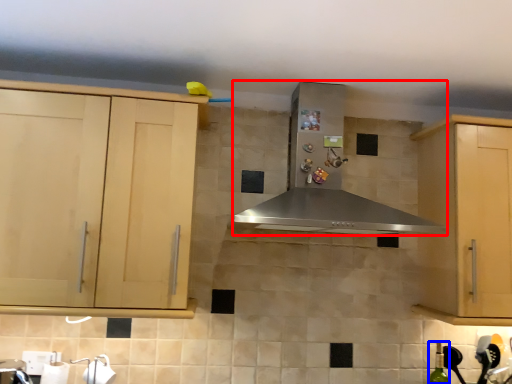
Question: Which object appears farthest to the camera in this image, home appliance (highlighted by a red box) or bottle (highlighted by a blue box)?

Choices:
 (A) home appliance
 (B) bottle

Answer: (B)